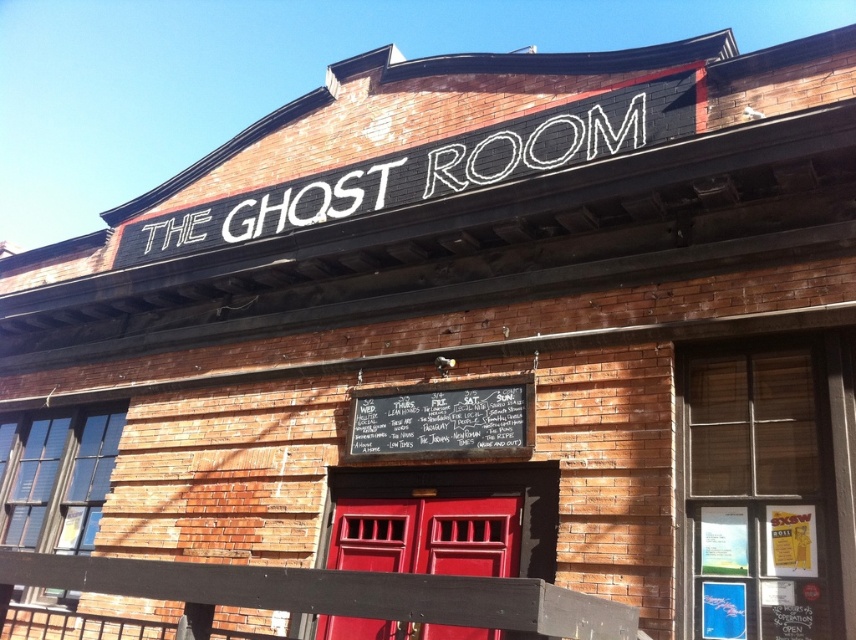
Question: Is matte wood door at center further to camera compared to black chalkboard at center?

Choices:
 (A) no
 (B) yes

Answer: (A)

Question: Does matte wood door at center have a greater width compared to black chalkboard at center?

Choices:
 (A) yes
 (B) no

Answer: (A)

Question: Can you confirm if matte wood door at center is positioned above black chalkboard at center?

Choices:
 (A) yes
 (B) no

Answer: (B)

Question: Among these points, which one is nearest to the camera?

Choices:
 (A) (409, 515)
 (B) (508, 420)

Answer: (B)